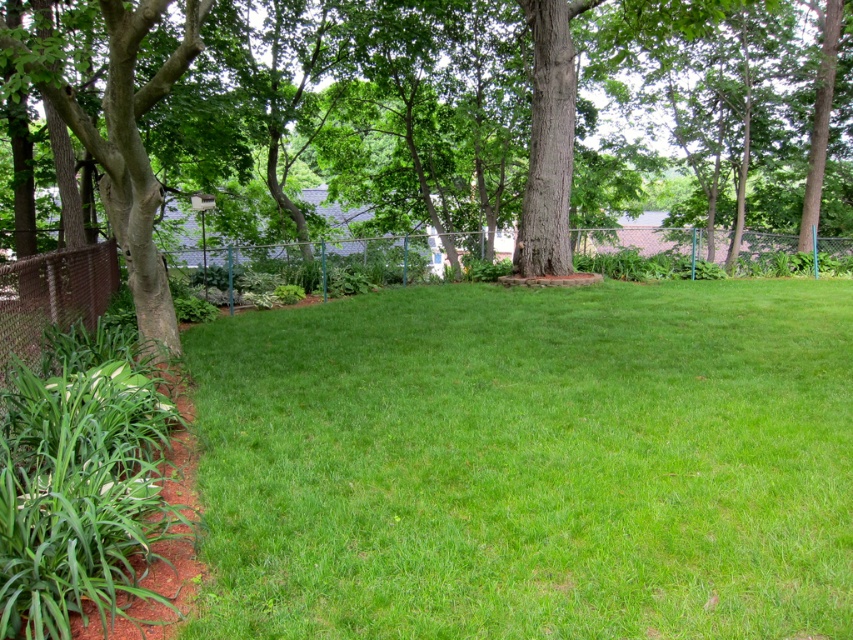
Is green grass at center above green leafy tree at center?

No.

Is green grass at center smaller than green leafy tree at center?

Correct, green grass at center occupies less space than green leafy tree at center.

Looking at this image, who is more forward, (x=422, y=420) or (x=120, y=60)?

Point (x=120, y=60) is in front.

The width and height of the screenshot is (853, 640). I want to click on green grass at center, so click(531, 461).

Can you confirm if green grass at center is positioned to the right of brown chain-link fence at lower left?

Yes, green grass at center is to the right of brown chain-link fence at lower left.

Does green grass at center lie behind brown chain-link fence at lower left?

No, it is not.

Locate an element on the screen. The height and width of the screenshot is (640, 853). green grass at center is located at coordinates (531, 461).

Find the location of `green grass at center`. green grass at center is located at coordinates (531, 461).

Which is more to the right, green leafy tree at center or brown chain-link fence at lower left?

Positioned to the right is green leafy tree at center.

Find the location of a particular element. The width and height of the screenshot is (853, 640). green leafy tree at center is located at coordinates (451, 108).